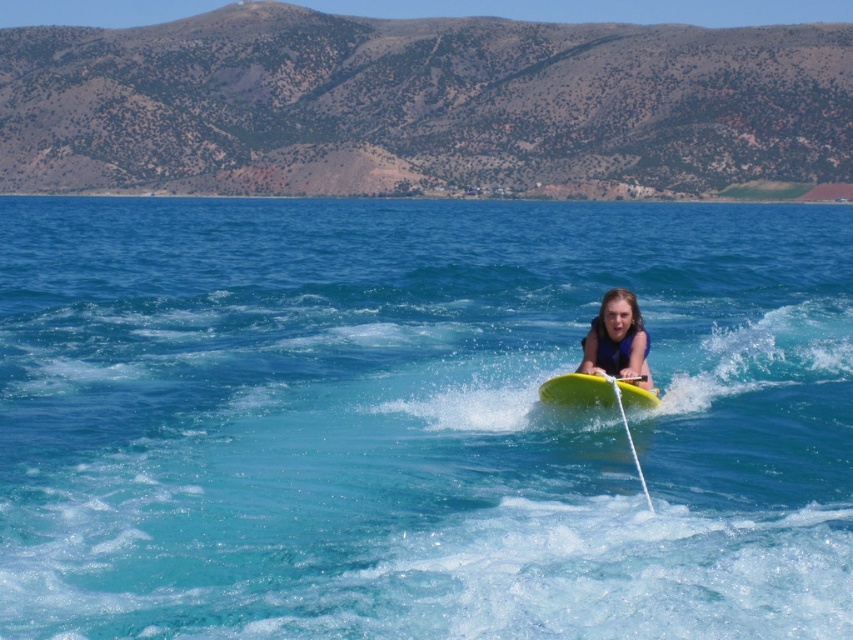
You are a photographer trying to capture the perfect shot of the matte yellow surfboard at center. The camera has a grid overlay with coordinates from 0 to 1 on both axes. Where exactly should you aim your camera to ensure the surfboard is centered in the frame?

The matte yellow surfboard at center is located at coordinates point (x=618, y=340), so you should aim your camera at that exact point to center it in the frame.

You are standing on the dock and see the matte yellow surfboard at center floating on the water. If you want to retrieve it using a 60 feet long fishing rod, will you be able to reach it?

The matte yellow surfboard at center is 72.11 feet away from viewer. Since the fishing rod is only 60 feet long, you cannot reach the surfboard.